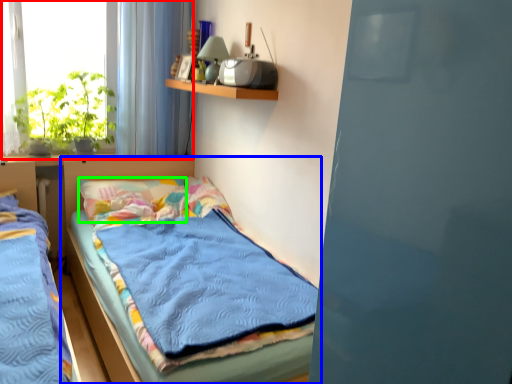
Question: Based on their relative distances, which object is farther from window (highlighted by a red box)? Choose from bed (highlighted by a blue box) and pillow (highlighted by a green box).

Choices:
 (A) bed
 (B) pillow

Answer: (A)